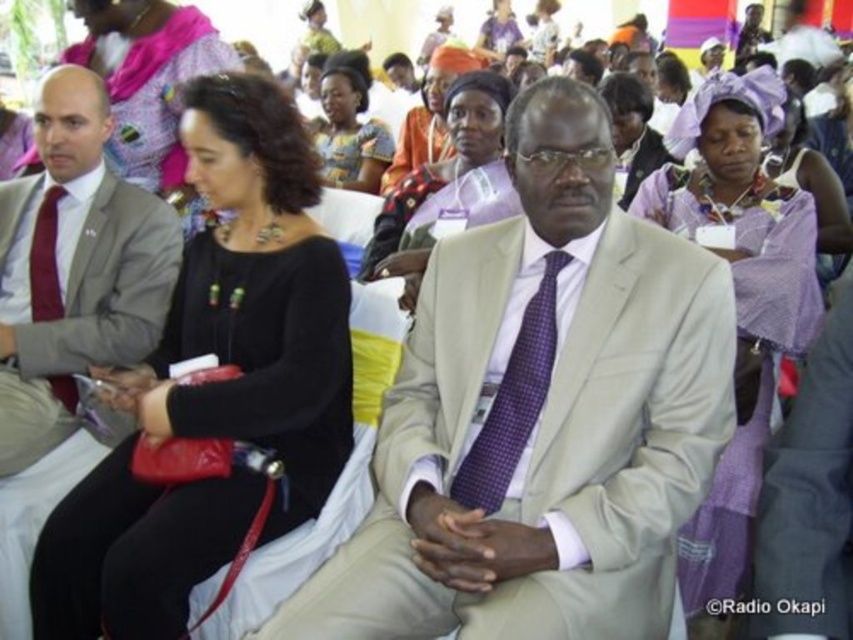
You are organizing a photo shoot and need to position the matte gray suit at left and the purple woven fabric headscarf at upper center in a way that maintains their original spatial relationship. Which object should be placed to the right side of the other?

The purple woven fabric headscarf at upper center should be placed to the right of the matte gray suit at left because the matte gray suit at left is to the left of purple woven fabric headscarf at upper center.

You are attending a conference and need to move from your current position to the exit located at point (489, 513). There is an obstacle at point (425, 609). Will you have to go around the obstacle to reach the exit?

Yes, you will have to go around the obstacle at point (425, 609) because it is in front of the exit at point (489, 513).

In the scene of a formal gathering, you see a beige fabric suit at center and a purple checkered tie at center. Which object is positioned more to the left?

The purple checkered tie at center is more to the left than the beige fabric suit at center.